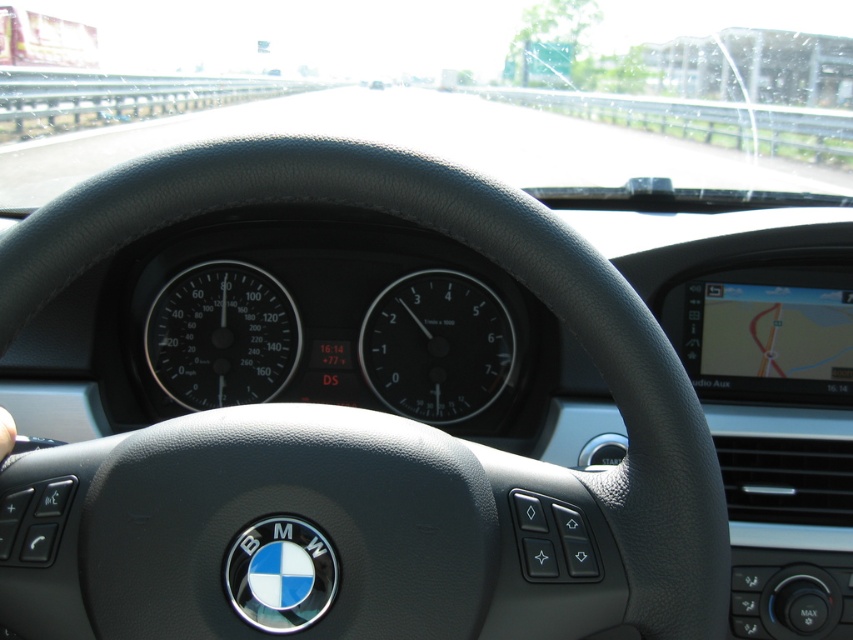
Question: Is transparent glass windshield at upper center thinner than black matte speedometer at center?

Choices:
 (A) no
 (B) yes

Answer: (A)

Question: Which point is closer to the camera?

Choices:
 (A) black glass tachometer at center
 (B) transparent glass windshield at upper center
 (C) black matte speedometer at center

Answer: (B)

Question: Which of these objects is positioned closest to the black glass tachometer at center?

Choices:
 (A) transparent glass windshield at upper center
 (B) black matte speedometer at center

Answer: (B)

Question: Which of the following is the closest to the observer?

Choices:
 (A) (254, 284)
 (B) (666, 147)
 (C) (393, 365)

Answer: (C)

Question: Is transparent glass windshield at upper center bigger than black glass tachometer at center?

Choices:
 (A) yes
 (B) no

Answer: (A)

Question: Is transparent glass windshield at upper center below black matte speedometer at center?

Choices:
 (A) no
 (B) yes

Answer: (A)